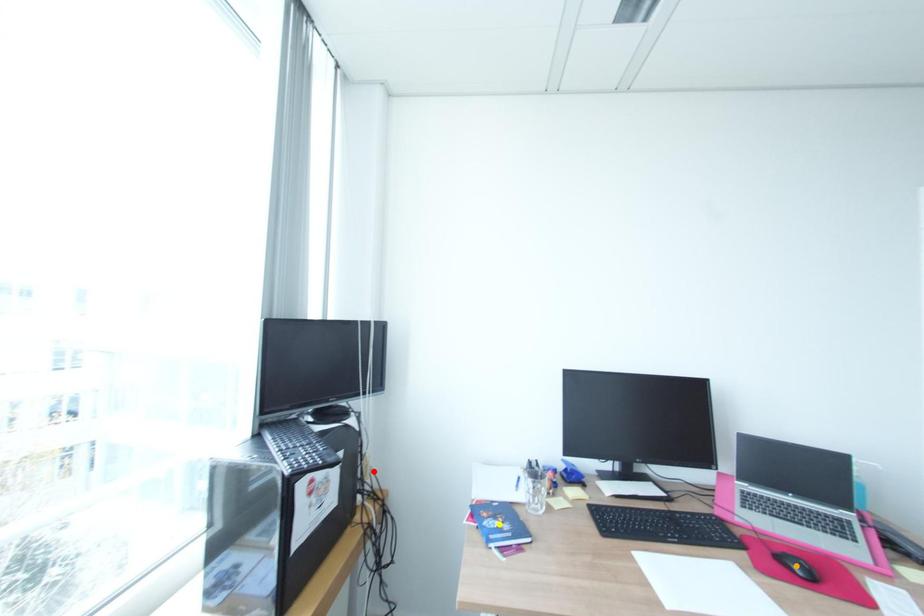
Order these from nearest to farthest:
yellow point, orange point, red point

orange point
yellow point
red point